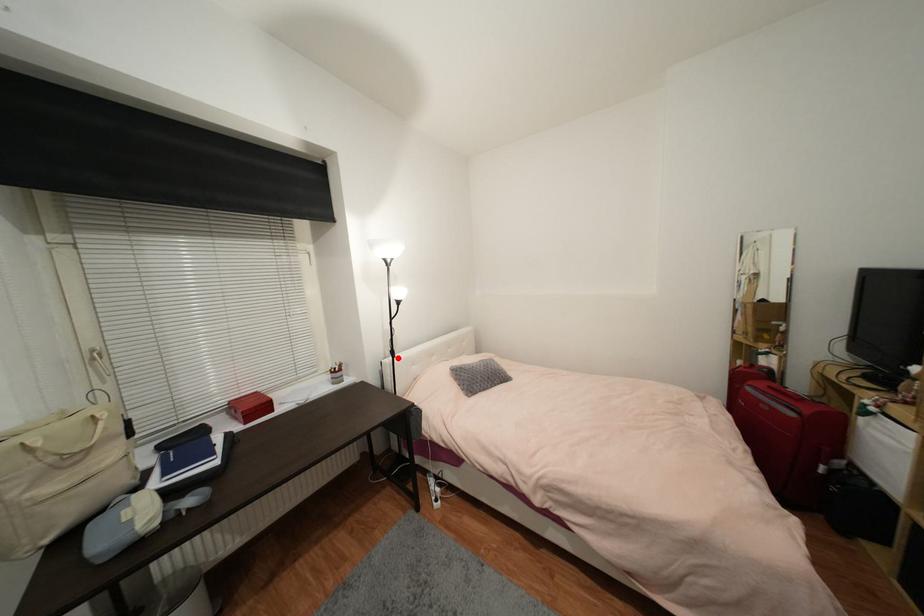
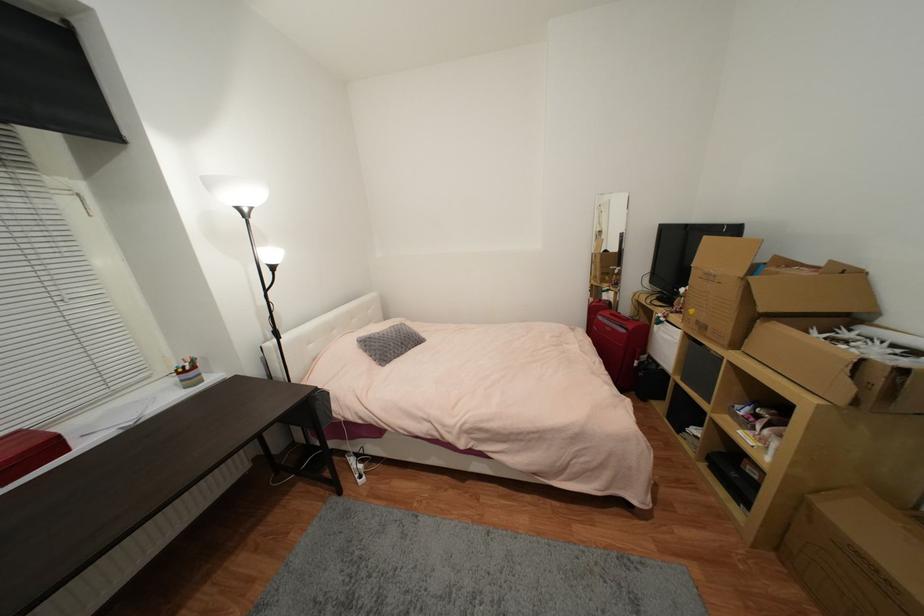
Question: I am providing you with two images of the same scene from different viewpoints. A red point is shown in image1. For the corresponding object point in image2, is it positioned nearer or farther from the camera?

Choices:
 (A) Nearer
 (B) Farther

Answer: (A)